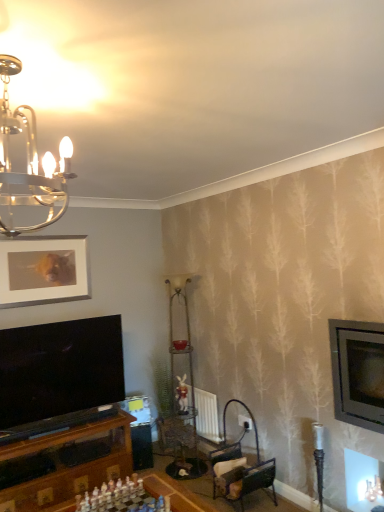
Question: Are metallic chandelier at upper left and metallic silver television at right far apart?

Choices:
 (A) yes
 (B) no

Answer: (A)

Question: Is metallic chandelier at upper left with metallic silver television at right?

Choices:
 (A) no
 (B) yes

Answer: (A)

Question: Is metallic silver television at right located within metallic chandelier at upper left?

Choices:
 (A) yes
 (B) no

Answer: (B)

Question: Does metallic chandelier at upper left have a greater width compared to metallic silver television at right?

Choices:
 (A) yes
 (B) no

Answer: (A)

Question: Is metallic chandelier at upper left to the right of metallic silver television at right from the viewer's perspective?

Choices:
 (A) no
 (B) yes

Answer: (A)

Question: Can you confirm if metallic chandelier at upper left is shorter than metallic silver television at right?

Choices:
 (A) yes
 (B) no

Answer: (A)

Question: From a real-world perspective, is white plastic chess set at center physically above metallic chandelier at upper left?

Choices:
 (A) no
 (B) yes

Answer: (A)

Question: Can you confirm if white plastic chess set at center is wider than metallic chandelier at upper left?

Choices:
 (A) no
 (B) yes

Answer: (B)

Question: Is white plastic chess set at center directly adjacent to metallic chandelier at upper left?

Choices:
 (A) yes
 (B) no

Answer: (B)

Question: Is white plastic chess set at center to the right of metallic chandelier at upper left from the viewer's perspective?

Choices:
 (A) yes
 (B) no

Answer: (A)

Question: Is metallic chandelier at upper left completely or partially inside white plastic chess set at center?

Choices:
 (A) yes
 (B) no

Answer: (B)

Question: Is white plastic chess set at center facing towards metallic chandelier at upper left?

Choices:
 (A) yes
 (B) no

Answer: (B)

Question: From the image's perspective, is metallic dark brown chair at lower center above metallic chandelier at upper left?

Choices:
 (A) yes
 (B) no

Answer: (B)